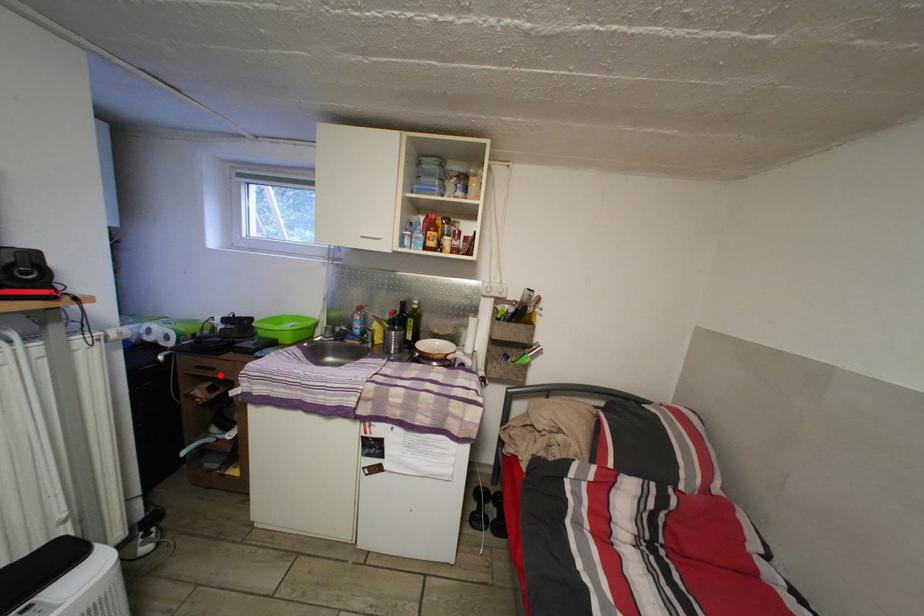
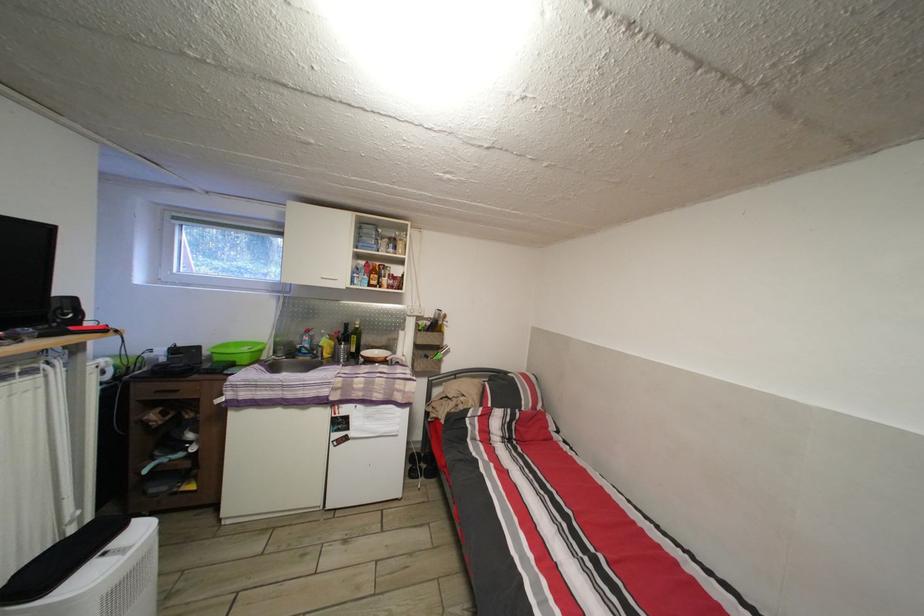
Where in the second image is the point corresponding to the highlighted location from the first image?

(184, 398)